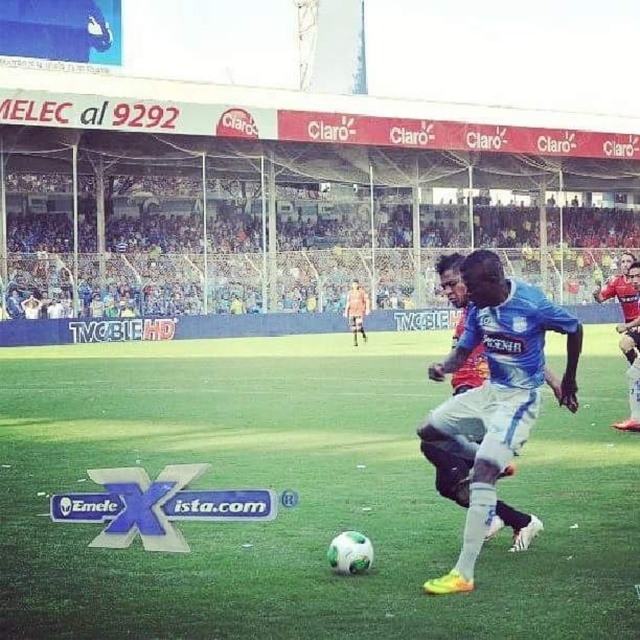
Is blue jersey at center to the right of light brown leather jacket at center from the viewer's perspective?

Yes, blue jersey at center is to the right of light brown leather jacket at center.

Who is higher up, blue jersey at center or light brown leather jacket at center?

light brown leather jacket at center is above.

Is point (467, 518) farther from viewer compared to point (364, 291)?

No, (467, 518) is in front of (364, 291).

Locate an element on the screen. The image size is (640, 640). blue jersey at center is located at coordinates (496, 392).

Does point (33, 445) come farther from viewer compared to point (362, 326)?

No, it is in front of (362, 326).

Between point (212, 408) and point (356, 291), which one is positioned behind?

The point (356, 291) is behind.

The image size is (640, 640). Describe the element at coordinates (305, 496) in the screenshot. I see `green grass soccer ball at center` at that location.

This screenshot has height=640, width=640. I want to click on green grass soccer ball at center, so click(305, 496).

Can you confirm if green grass soccer ball at center is taller than blue jersey at center?

No.

Which is behind, point (179, 621) or point (490, 408)?

The point (490, 408) is more distant.

This screenshot has width=640, height=640. Identify the location of green grass soccer ball at center. (305, 496).

Find the location of a particular element. This screenshot has height=640, width=640. green grass soccer ball at center is located at coordinates (305, 496).